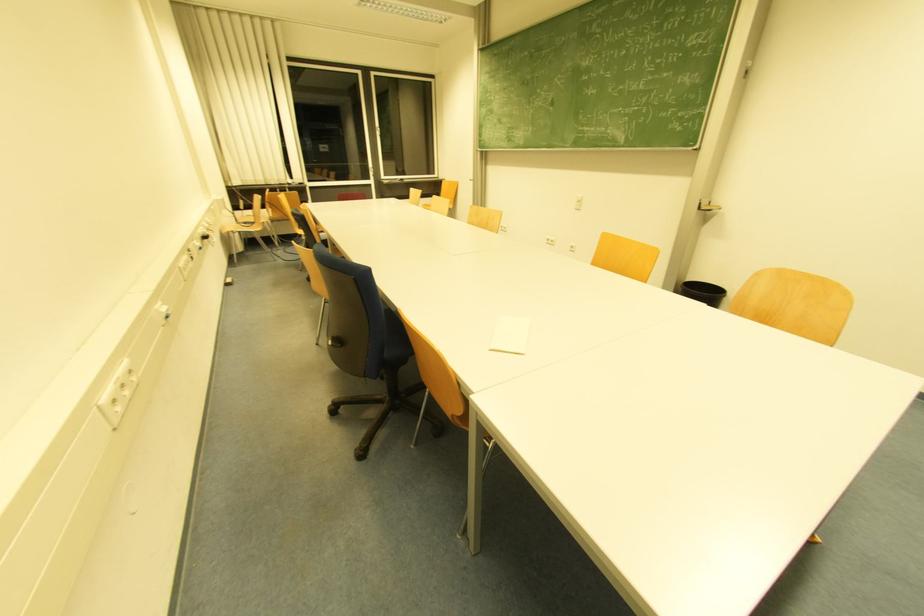
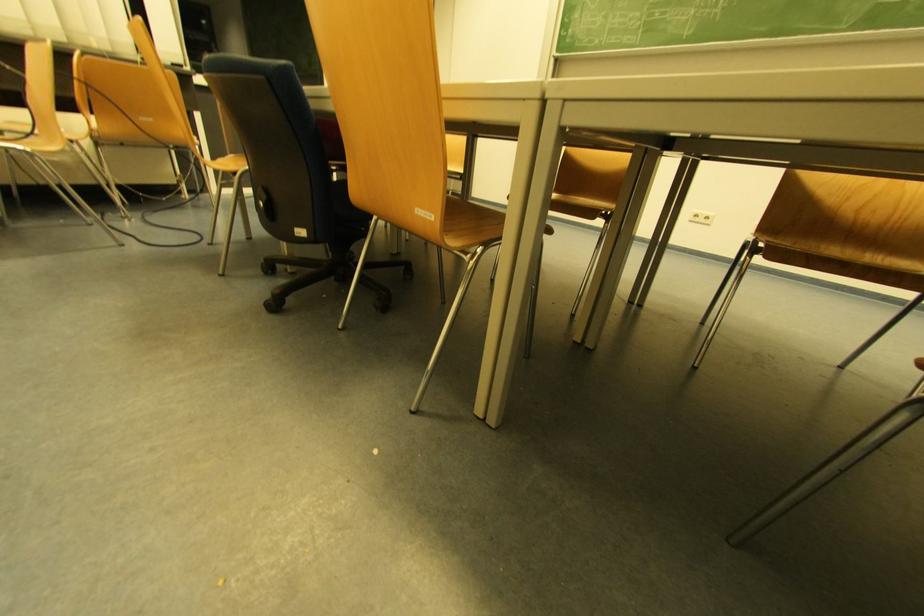
What movement of the cameraman would produce the second image?

The movement direction of the cameraman is left, forward.